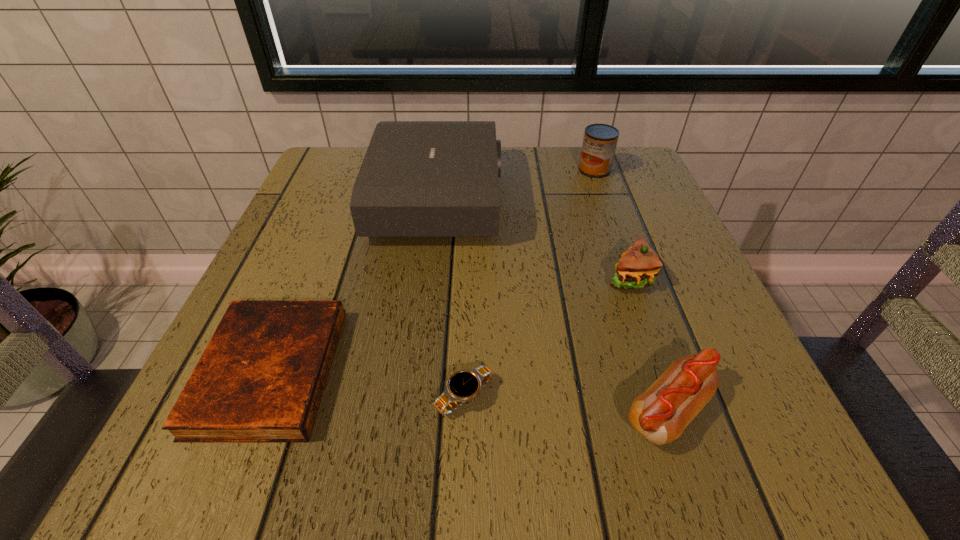
Identify the location of vacant region that satisfies the following two spatial constraints: 1. on the front-facing side of the sausage; 2. on the right side of the projector. This screenshot has height=540, width=960. (412, 411).

I want to click on vacant position in the image that satisfies the following two spatial constraints: 1. on the back side of the fourth nearest object; 2. on the left side of the can, so click(591, 170).

Find the location of a particular element. This screenshot has height=540, width=960. free space in the image that satisfies the following two spatial constraints: 1. on the front-facing side of the projector; 2. on the right side of the third farthest object is located at coordinates (428, 278).

Locate an element on the screen. Image resolution: width=960 pixels, height=540 pixels. free location that satisfies the following two spatial constraints: 1. on the spine side of the sausage; 2. on the left side of the Bible is located at coordinates (254, 411).

Find the location of a particular element. The height and width of the screenshot is (540, 960). vacant position in the image that satisfies the following two spatial constraints: 1. on the back side of the watch; 2. on the spine side of the Bible is located at coordinates (x=465, y=372).